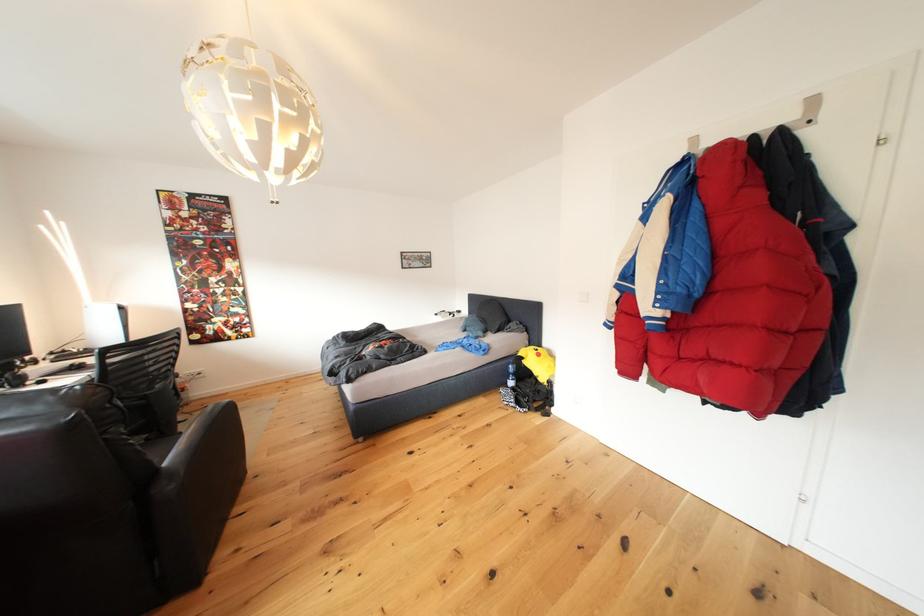
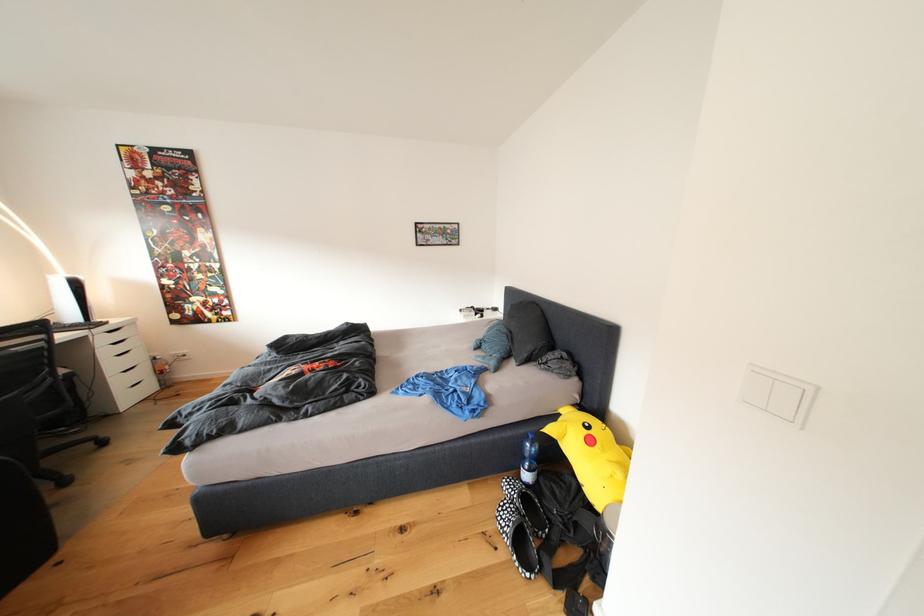
The point at (517,373) is marked in the first image. Where is the corresponding point in the second image?

(531, 451)